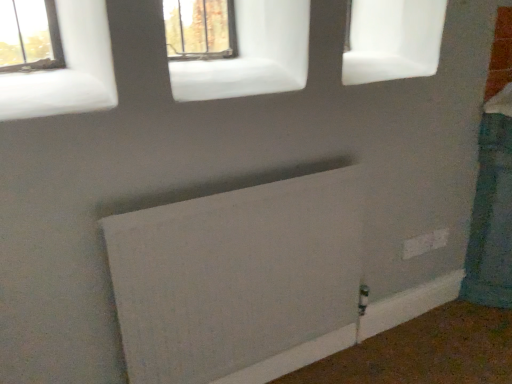
I want to click on white matte radiator at lower center, so click(x=238, y=280).

In order to face white matte radiator at lower center, should I rotate leftwards or rightwards?

Turn right by 0.636 degrees to look at white matte radiator at lower center.

Locate an element on the screen. This screenshot has height=384, width=512. white plastic electric outlet at lower right is located at coordinates (425, 243).

Does white matte window at upper left, which is the first window from left to right, appear on the left side of white plastic electric outlet at lower right?

Yes, white matte window at upper left, which is the first window from left to right, is to the left of white plastic electric outlet at lower right.

Would you say white matte window at upper left, the 1th window in the front-to-back sequence, contains white plastic electric outlet at lower right?

That's incorrect, white plastic electric outlet at lower right is not inside white matte window at upper left, the 1th window in the front-to-back sequence.

Is the depth of white matte window at upper left, the 2th window positioned from the right, greater than that of white plastic electric outlet at lower right?

No.

Considering the sizes of objects white matte window at upper left, which appears as the first window when ordered from the bottom, and white plastic electric outlet at lower right in the image provided, who is shorter, white matte window at upper left, which appears as the first window when ordered from the bottom, or white plastic electric outlet at lower right?

white plastic electric outlet at lower right.

From the image's perspective, which one is positioned higher, white matte radiator at lower center or matte glass window at upper center, which is the second window in bottom-to-top order?

matte glass window at upper center, which is the second window in bottom-to-top order, from the image's perspective.

Considering the relative positions of white matte radiator at lower center and matte glass window at upper center, the 1th window positioned from the right, in the image provided, is white matte radiator at lower center to the left or to the right of matte glass window at upper center, the 1th window positioned from the right,?

white matte radiator at lower center is to the right of matte glass window at upper center, the 1th window positioned from the right.

Is white matte radiator at lower center turned away from matte glass window at upper center, which appears as the second window when viewed from the left?

That's not correct — white matte radiator at lower center is not looking away from matte glass window at upper center, which appears as the second window when viewed from the left.

Would you say white matte radiator at lower center is inside or outside matte glass window at upper center, the 2th window from the front?

The correct answer is: outside.

From a real-world perspective, is white matte radiator at lower center positioned above or below white matte window at upper left, which is the first window from left to right?

In terms of real-world spatial position, white matte radiator at lower center is below white matte window at upper left, which is the first window from left to right.

Considering the relative sizes of white matte radiator at lower center and white matte window at upper left, the 1th window in the front-to-back sequence, in the image provided, is white matte radiator at lower center taller than white matte window at upper left, the 1th window in the front-to-back sequence,?

Yes.

Which object is further away from the camera, white matte radiator at lower center or white matte window at upper left, which is the first window from left to right?

white matte radiator at lower center is behind.

Based on the photo, which object is positioned more to the left, white matte radiator at lower center or white matte window at upper left, the 1th window in the front-to-back sequence?

white matte window at upper left, the 1th window in the front-to-back sequence.

Does white matte window at upper left, which appears as the first window when ordered from the bottom, turn towards matte glass window at upper center, which is the second window in bottom-to-top order?

No.

From a real-world perspective, which is physically below, white matte window at upper left, the 1th window in the front-to-back sequence, or matte glass window at upper center, the 1th window from the top?

white matte window at upper left, the 1th window in the front-to-back sequence, is physically lower.

Is point (72, 67) closer or farther from the camera than point (210, 23)?

Clearly, point (72, 67) is closer to the camera than point (210, 23).

Can you confirm if white matte window at upper left, the second window when ordered from top to bottom, is thinner than matte glass window at upper center, which is the second window in bottom-to-top order?

Incorrect, the width of white matte window at upper left, the second window when ordered from top to bottom, is not less than that of matte glass window at upper center, which is the second window in bottom-to-top order.

Is white plastic electric outlet at lower right inside or outside of matte glass window at upper center, which is the second window in bottom-to-top order?

white plastic electric outlet at lower right exists outside the volume of matte glass window at upper center, which is the second window in bottom-to-top order.

How many degrees apart are the facing directions of white plastic electric outlet at lower right and matte glass window at upper center, which appears as the second window when viewed from the left?

0.318 degrees separate the facing orientations of white plastic electric outlet at lower right and matte glass window at upper center, which appears as the second window when viewed from the left.

Can you confirm if white plastic electric outlet at lower right is shorter than matte glass window at upper center, positioned as the first window in back-to-front order?

Yes.

From the image's perspective, between white plastic electric outlet at lower right and matte glass window at upper center, positioned as the first window in back-to-front order, who is located below?

white plastic electric outlet at lower right is shown below in the image.

From a real-world perspective, does matte glass window at upper center, which appears as the second window when viewed from the left, stand above white matte radiator at lower center?

Correct, in the physical world, matte glass window at upper center, which appears as the second window when viewed from the left, is higher than white matte radiator at lower center.

Could you tell me if matte glass window at upper center, positioned as the first window in back-to-front order, is turned towards white matte radiator at lower center?

No, matte glass window at upper center, positioned as the first window in back-to-front order, is not aimed at white matte radiator at lower center.

From the picture: How different are the orientations of matte glass window at upper center, positioned as the first window in back-to-front order, and white matte radiator at lower center in degrees?

There is a 0.961-degree angle between the facing directions of matte glass window at upper center, positioned as the first window in back-to-front order, and white matte radiator at lower center.

From the picture: Is white plastic electric outlet at lower right closer to the viewer compared to white matte radiator at lower center?

No, white plastic electric outlet at lower right is further to the viewer.

Considering the sizes of white plastic electric outlet at lower right and white matte radiator at lower center in the image, is white plastic electric outlet at lower right taller or shorter than white matte radiator at lower center?

In the image, white plastic electric outlet at lower right appears to be shorter than white matte radiator at lower center.

The width and height of the screenshot is (512, 384). There is a white plastic electric outlet at lower right. Find the location of `the 1st window above it (from a real-world perspective)`. the 1st window above it (from a real-world perspective) is located at coordinates (68, 69).

Identify the location of radiator below the matte glass window at upper center, the 1th window positioned from the right (from the image's perspective). (238, 280).

When comparing their distances from white plastic electric outlet at lower right, does white matte window at upper left, which is the first window from left to right, or white matte radiator at lower center seem further?

white matte window at upper left, which is the first window from left to right.

From the image, which object appears to be farther from white matte radiator at lower center, white plastic electric outlet at lower right or white matte window at upper left, which appears as the first window when ordered from the bottom?

white plastic electric outlet at lower right is further to white matte radiator at lower center.

Looking at the image, which one is located further to white matte radiator at lower center, matte glass window at upper center, which is the second window in bottom-to-top order, or white plastic electric outlet at lower right?

matte glass window at upper center, which is the second window in bottom-to-top order, is further to white matte radiator at lower center.

Which object lies further to the anchor point white matte window at upper left, the 2th window positioned from the right, matte glass window at upper center, the 1th window from the top, or white plastic electric outlet at lower right?

matte glass window at upper center, the 1th window from the top.

Based on their spatial positions, is white matte window at upper left, which is the first window from left to right, or white matte radiator at lower center closer to matte glass window at upper center, positioned as the first window in back-to-front order?

white matte window at upper left, which is the first window from left to right, lies closer to matte glass window at upper center, positioned as the first window in back-to-front order, than the other object.

Looking at the image, which one is located further to matte glass window at upper center, the 1th window from the top, white plastic electric outlet at lower right or white matte radiator at lower center?

white matte radiator at lower center.

Estimate the real-world distances between objects in this image. Which object is further from matte glass window at upper center, which appears as the second window when viewed from the left, white plastic electric outlet at lower right or white matte window at upper left, the second window when ordered from top to bottom?

white matte window at upper left, the second window when ordered from top to bottom, is further to matte glass window at upper center, which appears as the second window when viewed from the left.

When comparing their distances from white plastic electric outlet at lower right, does white matte radiator at lower center or white matte window at upper left, the second window when ordered from top to bottom, seem closer?

white matte radiator at lower center.

Locate an element on the screen. Image resolution: width=512 pixels, height=384 pixels. electric outlet between matte glass window at upper center, the 2th window from the front, and white matte radiator at lower center in the up-down direction is located at coordinates (425, 243).

Locate an element on the screen. window between matte glass window at upper center, the 1th window positioned from the right, and white matte radiator at lower center, in the vertical direction is located at coordinates (68, 69).

Find the location of a particular element. This screenshot has width=512, height=384. radiator situated between white matte window at upper left, which is the first window from left to right, and white plastic electric outlet at lower right from left to right is located at coordinates (238, 280).

Find the location of a particular element. Image resolution: width=512 pixels, height=384 pixels. window between white matte window at upper left, the second window when ordered from top to bottom, and white plastic electric outlet at lower right, in the horizontal direction is located at coordinates (200, 29).